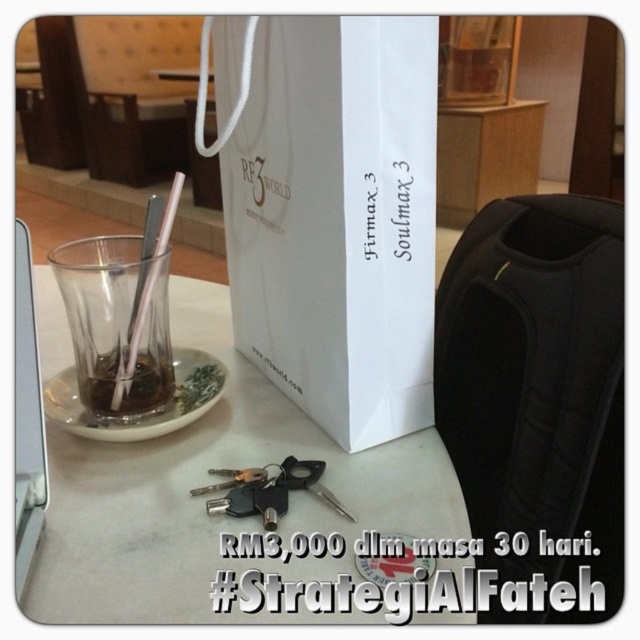
How distant is black fabric backpack at right from transparent glass at center?

black fabric backpack at right is 24.62 centimeters away from transparent glass at center.

Is point (506, 278) in front of point (83, 292)?

No.

Who is more distant from viewer, (531, 323) or (138, 236)?

The point (531, 323) is behind.

Locate an element on the screen. The image size is (640, 640). black fabric backpack at right is located at coordinates (536, 390).

How much distance is there between white paper bag at center and translucent glass cup at center?

5.34 inches

Is white paper bag at center to the right of translucent glass cup at center from the viewer's perspective?

Correct, you'll find white paper bag at center to the right of translucent glass cup at center.

The image size is (640, 640). Find the location of `white paper bag at center`. white paper bag at center is located at coordinates (337, 220).

Which is more to the left, white paper bag at center or transparent glass at center?

transparent glass at center

Image resolution: width=640 pixels, height=640 pixels. What do you see at coordinates (337, 220) in the screenshot?
I see `white paper bag at center` at bounding box center [337, 220].

This screenshot has height=640, width=640. What are the coordinates of `white paper bag at center` in the screenshot? It's located at (337, 220).